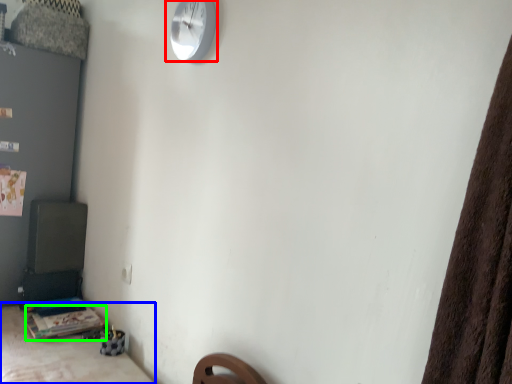
Question: Considering the real-world distances, which object is farthest from wall clock (highlighted by a red box)? furniture (highlighted by a blue box) or table (highlighted by a green box)?

Choices:
 (A) furniture
 (B) table

Answer: (B)